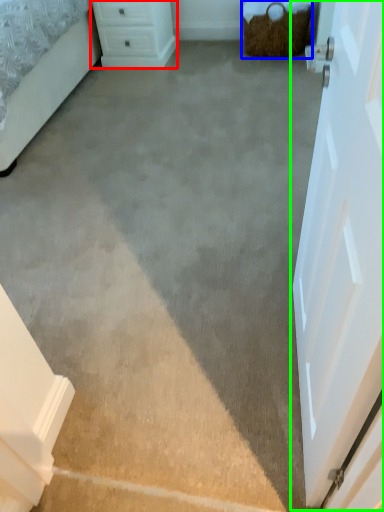
Question: Which is farther away from chest of drawers (highlighted by a red box)? basket (highlighted by a blue box) or door (highlighted by a green box)?

Choices:
 (A) basket
 (B) door

Answer: (B)